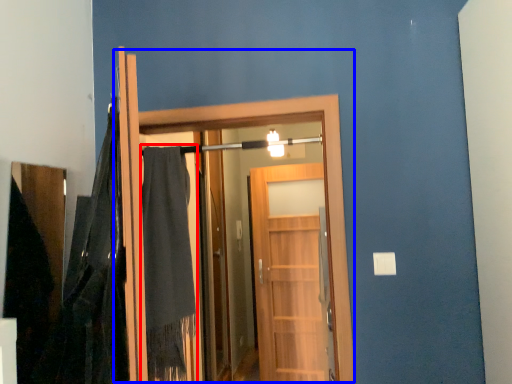
Question: Among these objects, which one is farthest to the camera, robe (highlighted by a red box) or door (highlighted by a blue box)?

Choices:
 (A) robe
 (B) door

Answer: (A)